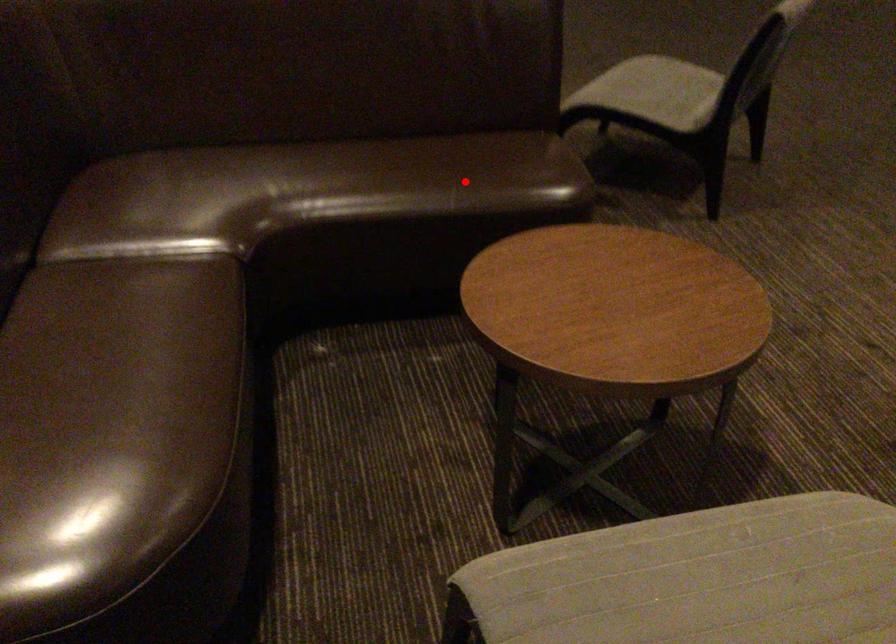
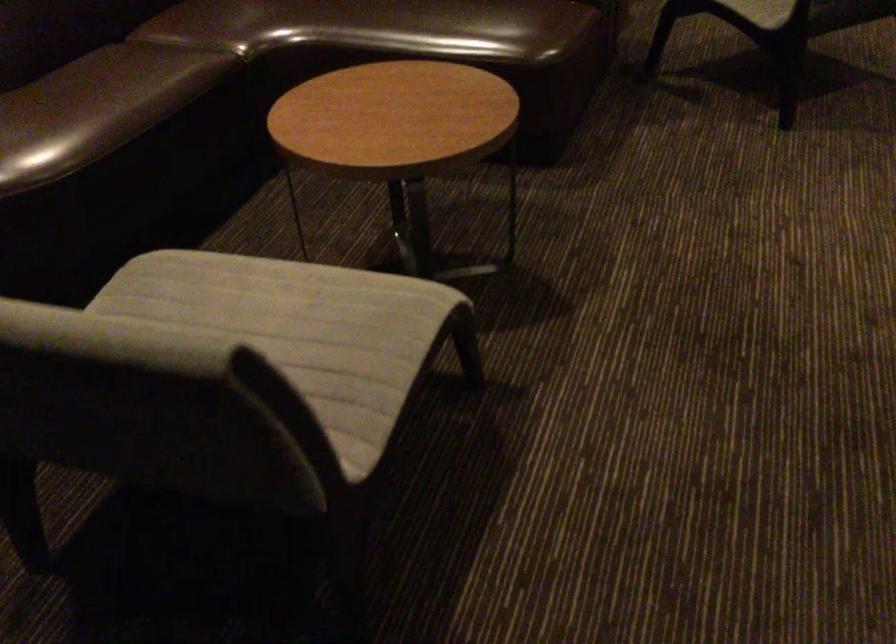
Question: A red point is marked in image1. In image2, is the corresponding 3D point closer to the camera or farther? Reply with the corresponding letter.

Choices:
 (A) The corresponding 3D point is closer.
 (B) The corresponding 3D point is farther.

Answer: (B)